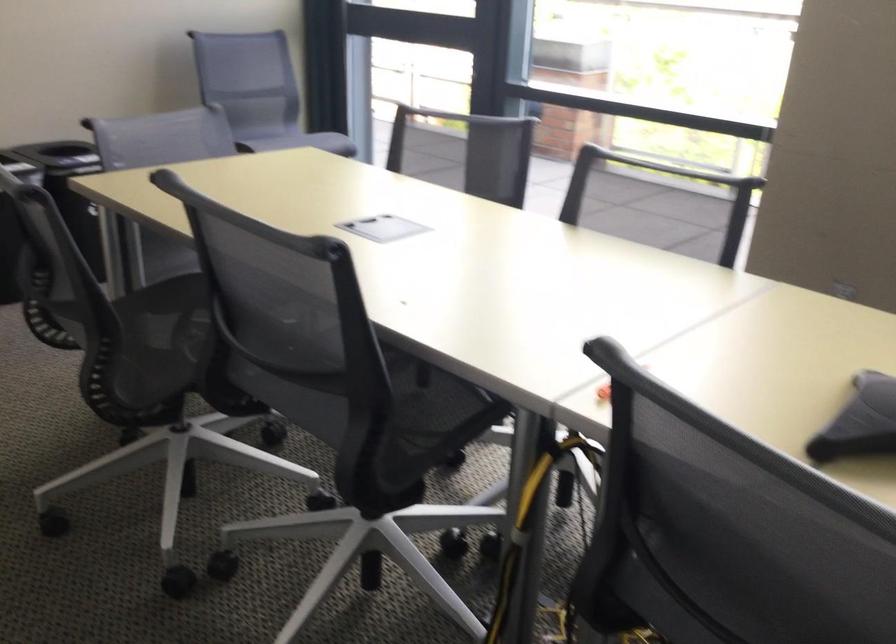
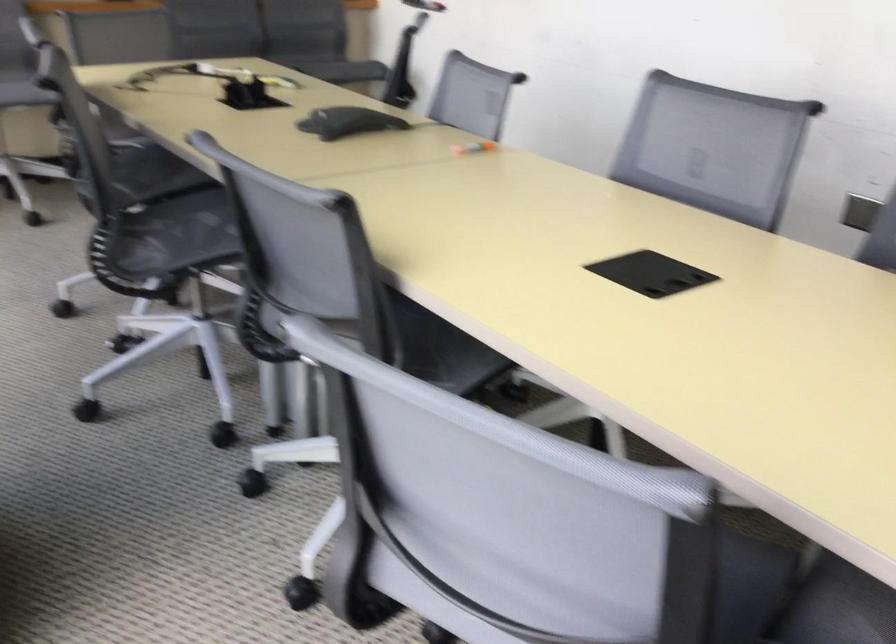
The point at (85, 292) is marked in the first image. Where is the corresponding point in the second image?

(879, 241)